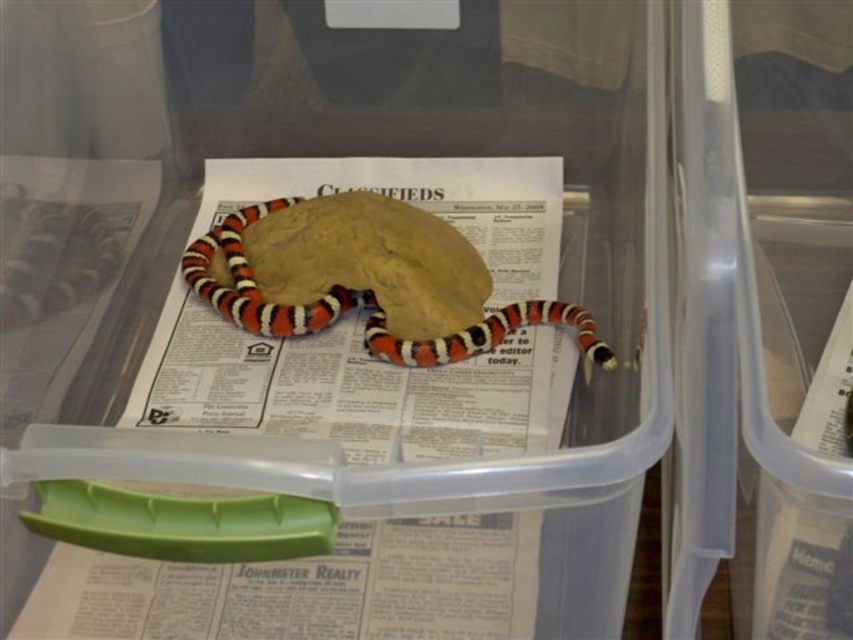
Question: Which point is closer to the camera taking this photo?

Choices:
 (A) (242, 291)
 (B) (19, 241)
 (C) (511, 412)

Answer: (C)

Question: Which point is closer to the camera?

Choices:
 (A) smooth glossy snake at left
 (B) white printed newspaper at center

Answer: (B)

Question: Is white printed newspaper at center bigger than smooth glossy snake at left?

Choices:
 (A) yes
 (B) no

Answer: (A)

Question: Does white printed newspaper at center appear on the left side of smooth glossy snake at left?

Choices:
 (A) no
 (B) yes

Answer: (A)

Question: Estimate the real-world distances between objects in this image. Which object is farther from the orange and white striped snake at center?

Choices:
 (A) white printed newspaper at center
 (B) smooth glossy snake at left

Answer: (B)

Question: Does white printed newspaper at center appear under orange and white striped snake at center?

Choices:
 (A) yes
 (B) no

Answer: (A)